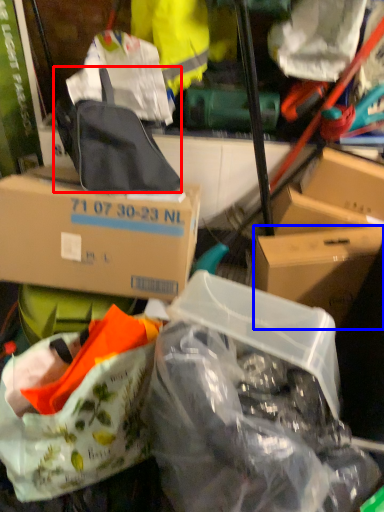
Question: Which of the following is the closest to the observer, backpack (highlighted by a red box) or box (highlighted by a blue box)?

Choices:
 (A) backpack
 (B) box

Answer: (A)